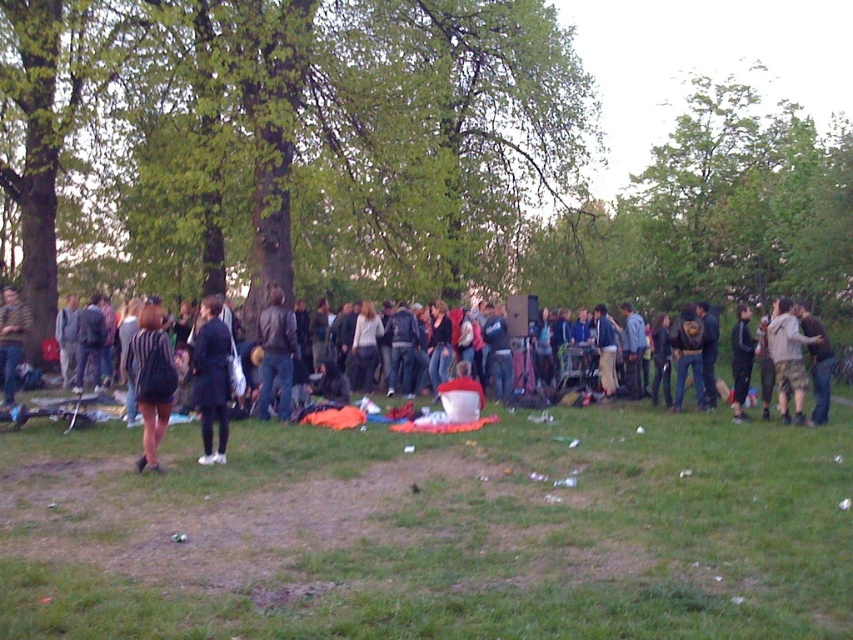
Locate an element on the screen. Image resolution: width=853 pixels, height=640 pixels. dark gray jacket at center is located at coordinates (151, 433).

Can you confirm if dark gray jacket at center is bigger than dark gray hoodie at center?

Yes.

Is point (140, 316) more distant than point (747, 348)?

No, it is in front of (747, 348).

The height and width of the screenshot is (640, 853). What are the coordinates of `dark gray jacket at center` in the screenshot? It's located at (151, 433).

Can you confirm if dark gray jacket at center is bigger than dark brown leather jacket at right?

Yes, dark gray jacket at center is bigger than dark brown leather jacket at right.

Which is behind, point (206, 435) or point (827, 404)?

Positioned behind is point (827, 404).

Describe the element at coordinates (151, 433) in the screenshot. The image size is (853, 640). I see `dark gray jacket at center` at that location.

Where is `dark gray jacket at center`? The width and height of the screenshot is (853, 640). dark gray jacket at center is located at coordinates (151, 433).

Between dark blue jacket at center and dark brown leather jacket at right, which one has less height?

dark brown leather jacket at right is shorter.

Who is more distant from viewer, (x=218, y=422) or (x=813, y=358)?

The point (x=813, y=358) is more distant.

Does point (209, 387) lie behind point (821, 371)?

No, it is in front of (821, 371).

Find the location of `dark blue jacket at center`. dark blue jacket at center is located at coordinates (212, 378).